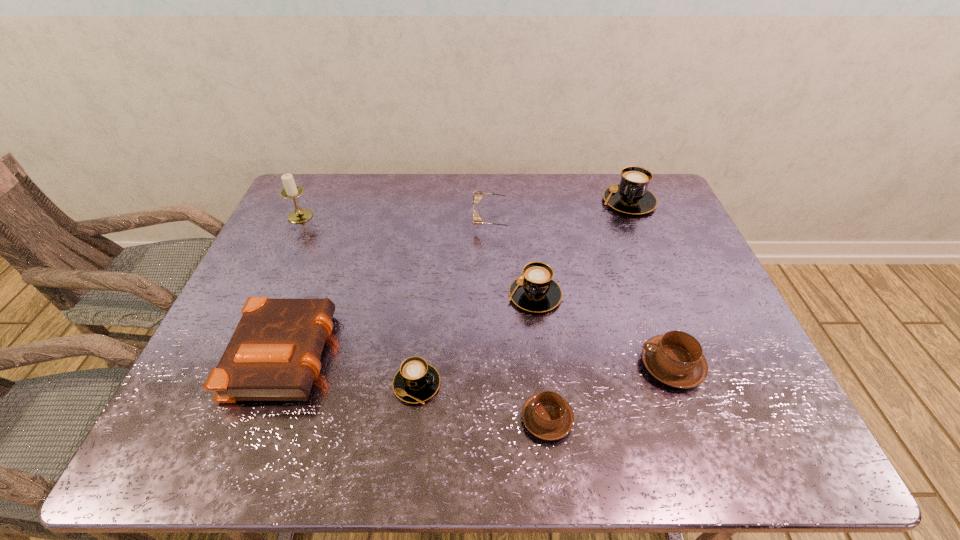
I want to click on vacant region that satisfies the following two spatial constraints: 1. on the front lenses of the fourth nearest cappuccino; 2. on the left side of the sunglasses, so click(x=498, y=295).

Image resolution: width=960 pixels, height=540 pixels. I want to click on blank space that satisfies the following two spatial constraints: 1. on the side of the left brown cappuccino with the handle; 2. on the spine side of the Bible, so click(x=540, y=351).

At what (x,y) coordinates should I click in order to perform the action: click on free space that satisfies the following two spatial constraints: 1. on the front lenses of the sunglasses; 2. on the right side of the fourth nearest cappuccino. Please return your answer as a coordinate pair (x, y). This screenshot has height=540, width=960. Looking at the image, I should click on (498, 295).

Where is `free space that satisfies the following two spatial constraints: 1. on the side of the second farthest black cappuccino with the handle; 2. on the left side of the smaller brown cappuccino`? The height and width of the screenshot is (540, 960). free space that satisfies the following two spatial constraints: 1. on the side of the second farthest black cappuccino with the handle; 2. on the left side of the smaller brown cappuccino is located at coordinates (533, 295).

Find the location of a particular element. vacant point that satisfies the following two spatial constraints: 1. on the front lenses of the sunglasses; 2. on the front side of the sixth object from right to left is located at coordinates (501, 384).